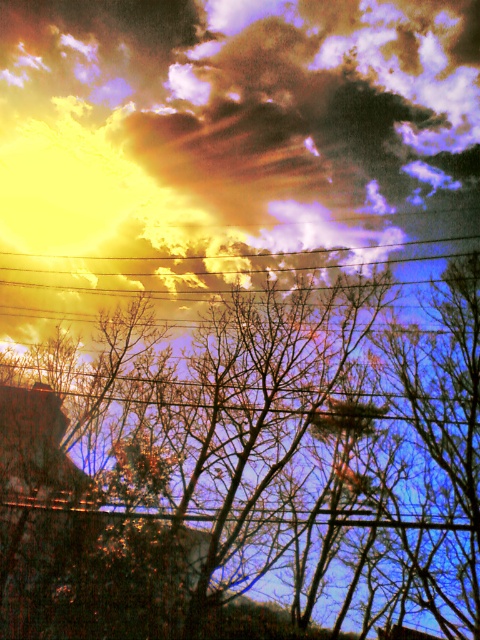
Is bare branches at center positioned behind golden textured cloud at upper center?

No, bare branches at center is closer to the viewer.

Which is more to the right, bare branches at center or golden textured cloud at upper center?

golden textured cloud at upper center

Identify the location of bare branches at center. The width and height of the screenshot is (480, 640). (248, 465).

Locate an element on the screen. bare branches at center is located at coordinates (248, 465).

Is point (144, 328) behind point (342, 257)?

Yes, point (144, 328) is farther from viewer.

Is point (294, 376) positioned before point (224, 266)?

Yes, point (294, 376) is in front of point (224, 266).

I want to click on bare branches at center, so click(x=248, y=465).

Can you confirm if golden textured cloud at upper center is thinner than metallic wire at upper center?

Incorrect, golden textured cloud at upper center's width is not less than metallic wire at upper center's.

Describe the element at coordinates (227, 147) in the screenshot. I see `golden textured cloud at upper center` at that location.

Does point (216, 225) lie behind point (224, 280)?

That is False.

The image size is (480, 640). I want to click on golden textured cloud at upper center, so click(x=227, y=147).